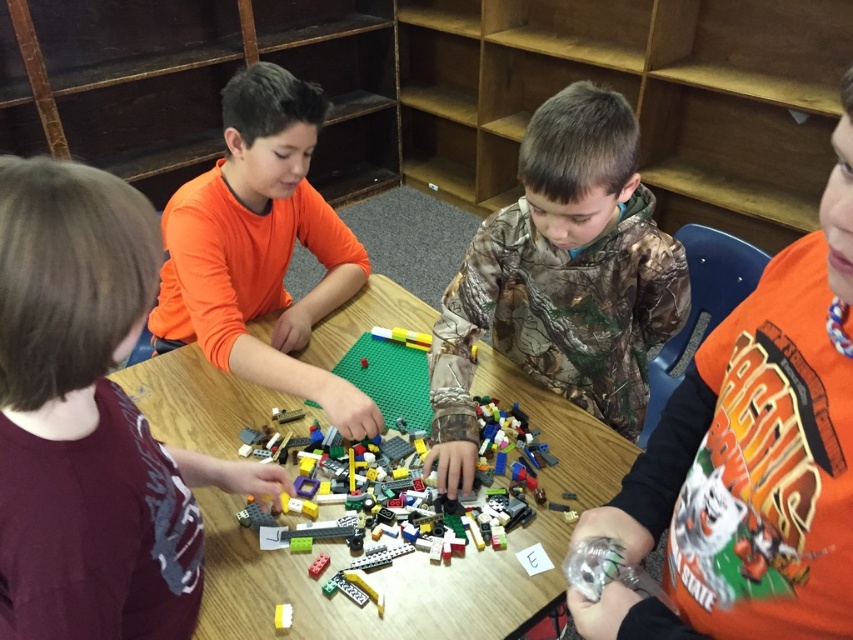
You are a teacher observing the children at the wooden table. You notice a camouflage fabric shirt at center and a white plastic block at center. How far apart are these two items from each other?

The camouflage fabric shirt at center is 28.38 inches from the white plastic block at center.

You are standing at the origin point in the image. The camouflage fabric shirt at center is represented by point (561, 280). Which direction should you move to reach the camouflage fabric shirt at center?

The camouflage fabric shirt at center is located at coordinates (561, 280), so you should move towards the center of the image to reach it.